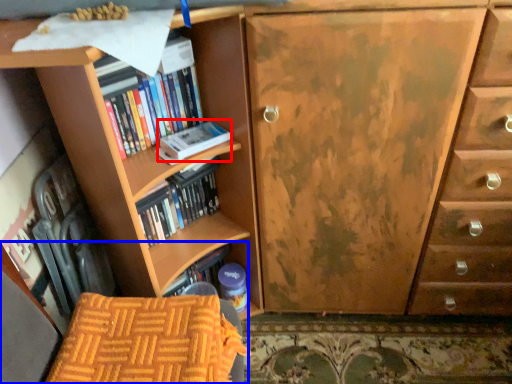
Question: Which of the following is the closest to the observer, paperback book (highlighted by a red box) or armchair (highlighted by a blue box)?

Choices:
 (A) paperback book
 (B) armchair

Answer: (B)